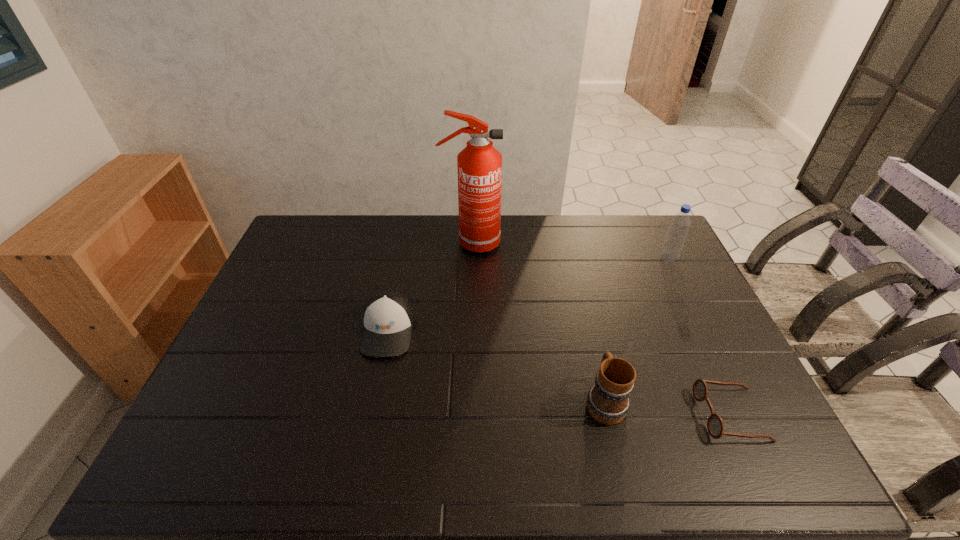
This screenshot has width=960, height=540. I want to click on free space located on the side of the mug with the handle, so click(590, 345).

The height and width of the screenshot is (540, 960). Identify the location of blank space located 0.250m on the side of the mug with the handle. (583, 309).

At what (x,y) coordinates should I click in order to perform the action: click on vacant space situated on the side of the mug with the handle. Please return your answer as a coordinate pair (x, y). Looking at the image, I should click on (578, 288).

Locate an element on the screen. The width and height of the screenshot is (960, 540). free space located 0.250m on the front panel of the leftmost object is located at coordinates (364, 447).

I want to click on vacant position located on the front-facing side of the spectacles, so click(660, 415).

I want to click on vacant space located 0.210m on the front-facing side of the spectacles, so click(x=614, y=415).

At what (x,y) coordinates should I click in order to perform the action: click on vacant space situated on the front-facing side of the spectacles. Please return your answer as a coordinate pair (x, y). Looking at the image, I should click on (554, 415).

You are a GUI agent. You are given a task and a screenshot of the screen. Output one action in this format:
    pyautogui.click(x=<x>, y=<y>)
    Task: Click on the fire extinguisher at the far edge
    The image size is (960, 540).
    Given the screenshot: What is the action you would take?
    pyautogui.click(x=479, y=164)

Locate an element on the screen. bottle that is at the far edge is located at coordinates (674, 240).

Locate an element on the screen. This screenshot has height=540, width=960. object present at the near edge is located at coordinates (715, 425).